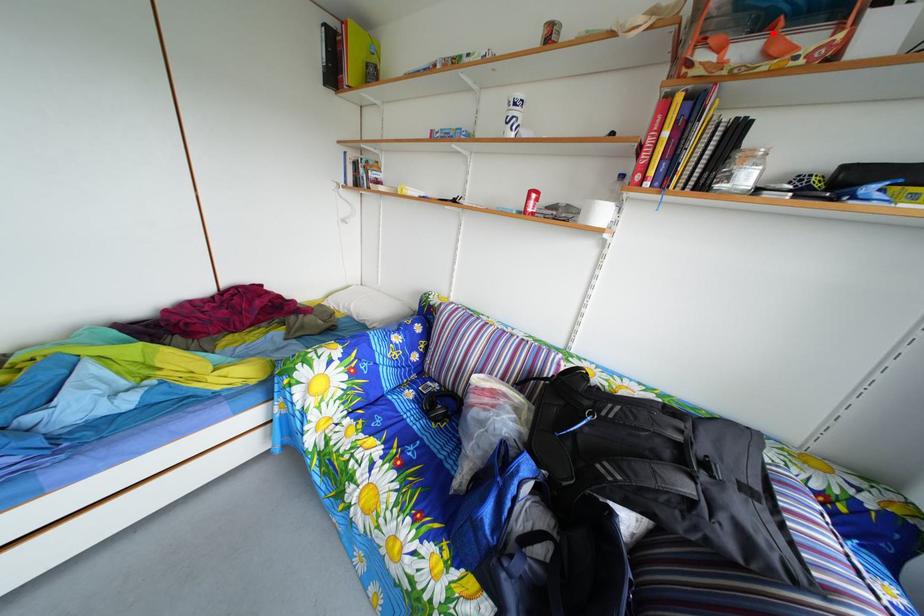
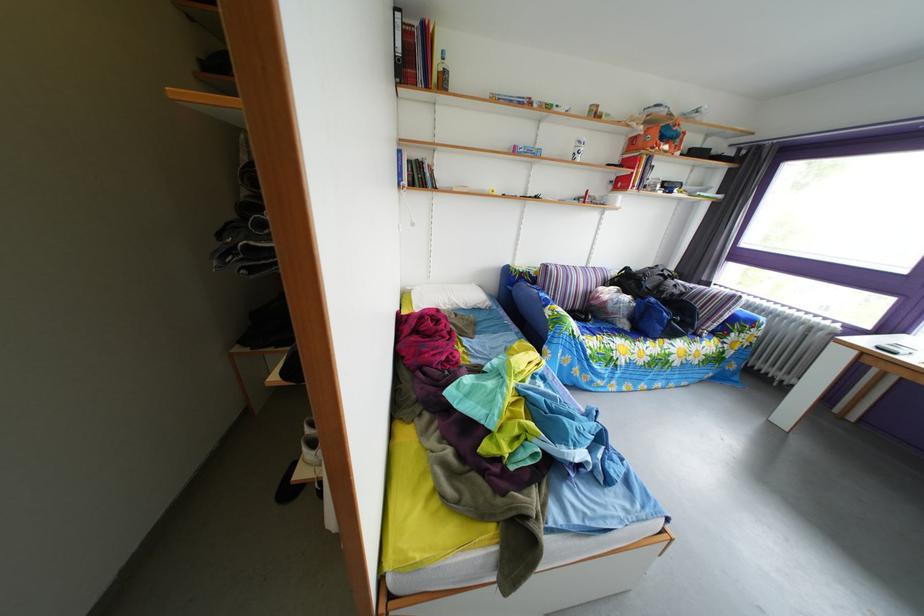
Find the pixel in the second image that matches the highlighted location in the first image.

(673, 147)